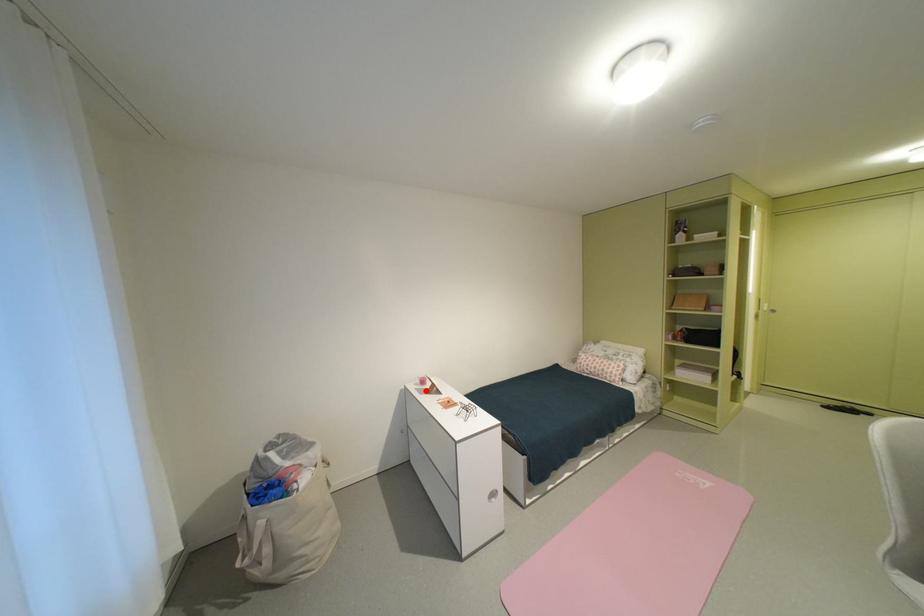
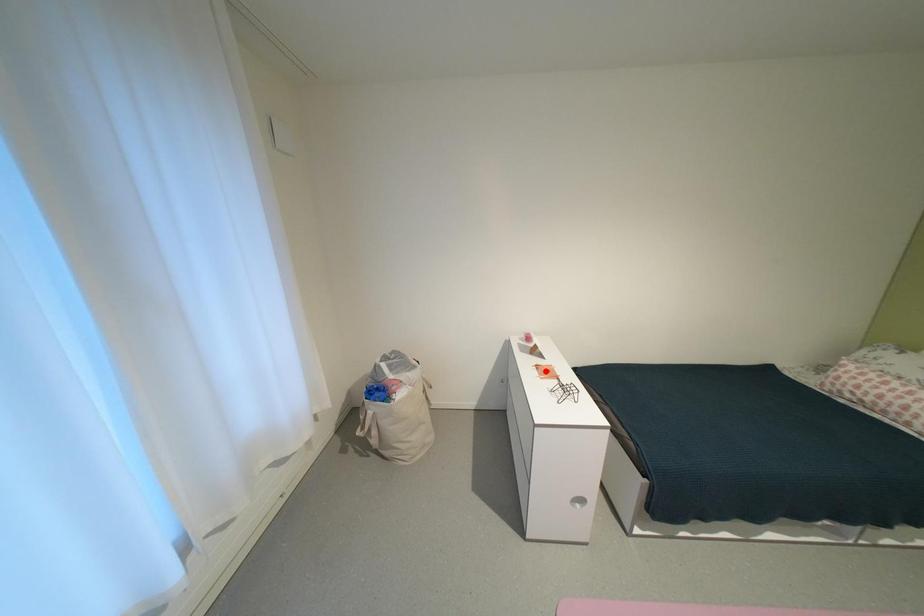
I am providing you with two images of the same scene from different viewpoints. A red point is marked on the first image and another point is marked on the second image. Are the points marked in image1 and image2 representing the same 3D position?

No